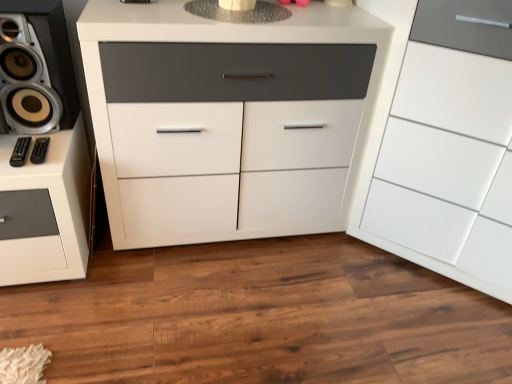
This screenshot has width=512, height=384. Identify the location of free space in front of white matte cabinet at center, marked as the first chest of drawers in a left-to-right arrangement. (210, 313).